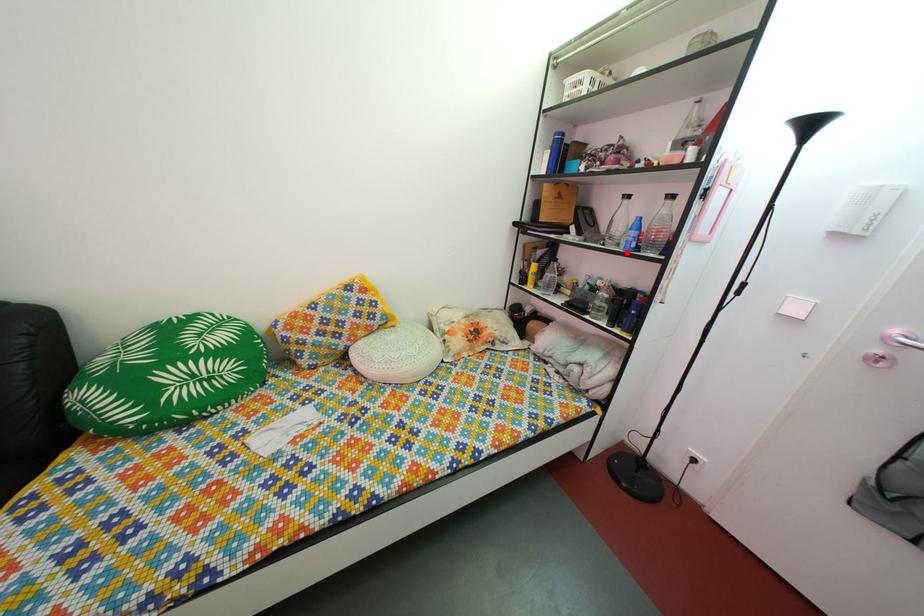
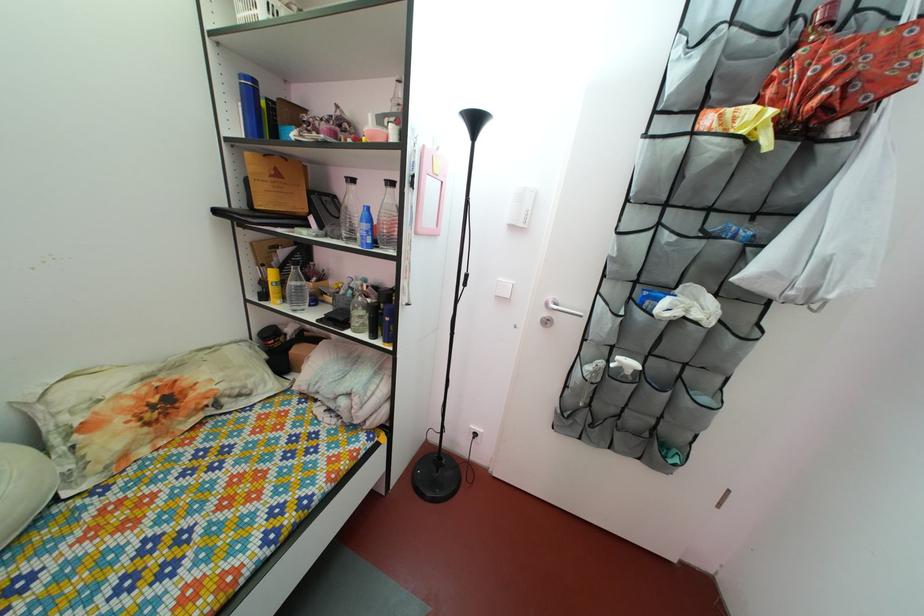
Question: I am providing you with two images of the same scene from different viewpoints. Image1 has a red point marked. In image2, the corresponding 3D location appears at what relative position? Reply with the corresponding letter.

Choices:
 (A) Closer
 (B) Farther

Answer: (B)